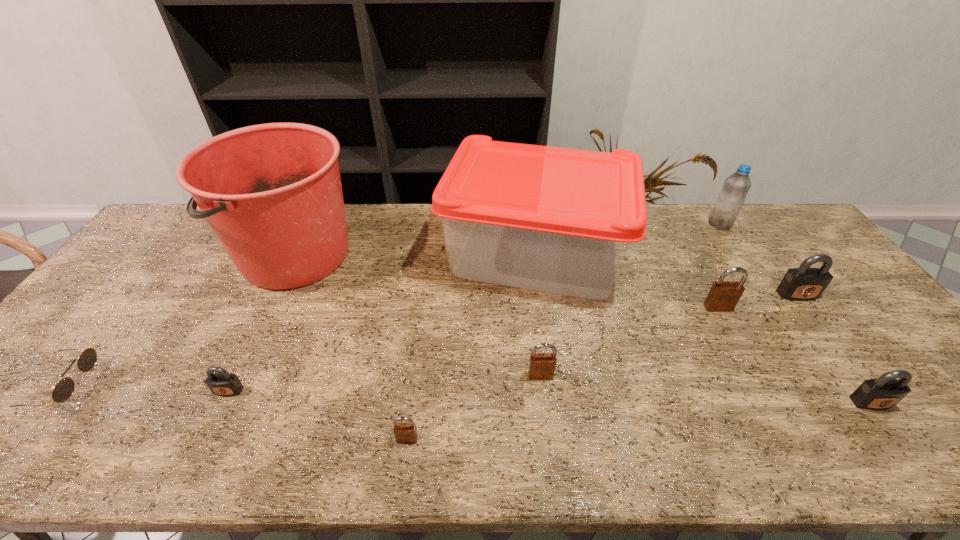
Identify the location of gray padlock that is the second closest to the water bottle. (882, 393).

Identify the location of gray padlock that stands as the closest to the seventh object from left to right. Image resolution: width=960 pixels, height=540 pixels. (804, 283).

Point out which brown padlock is positioned as the nearest to the tray. Please provide its 2D coordinates. Your answer should be formatted as a tuple, i.e. [(x, y)], where the tuple contains the x and y coordinates of a point satisfying the conditions above.

[(723, 296)]

Where is `brown padlock that can be found as the closest to the sunglasses`? The width and height of the screenshot is (960, 540). brown padlock that can be found as the closest to the sunglasses is located at coordinates (405, 433).

The width and height of the screenshot is (960, 540). I want to click on vacant region that satisfies the following two spatial constraints: 1. on the front side of the pink bucket; 2. on the front lenses of the leftmost object, so click(232, 387).

You are a GUI agent. You are given a task and a screenshot of the screen. Output one action in this format:
    pyautogui.click(x=<x>, y=<y>)
    Task: Click on the vacant space that satisfies the following two spatial constraints: 1. on the back side of the blue water bottle; 2. on the right side of the bucket
    This screenshot has width=960, height=540.
    Given the screenshot: What is the action you would take?
    coord(310,224)